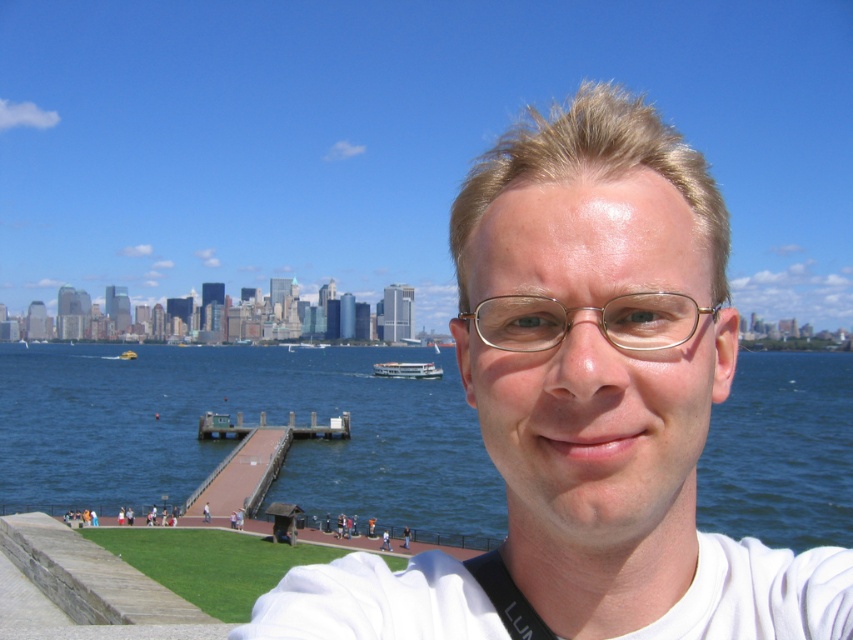
Does blue water at center lie in front of white glossy boat at center?

Yes, it is.

Is blue water at center to the left of white glossy boat at center from the viewer's perspective?

In fact, blue water at center is to the right of white glossy boat at center.

Between point (337, 444) and point (408, 376), which one is positioned in front?

Positioned in front is point (337, 444).

Identify the location of blue water at center. (247, 422).

Does white matte shirt at center lie in front of gold metallic glasses at center?

Yes, white matte shirt at center is closer to the viewer.

Can you confirm if white matte shirt at center is positioned above gold metallic glasses at center?

Indeed, white matte shirt at center is positioned over gold metallic glasses at center.

At what (x,y) coordinates should I click in order to perform the action: click on white matte shirt at center. Please return your answer as a coordinate pair (x, y). Looking at the image, I should click on (614, 381).

Image resolution: width=853 pixels, height=640 pixels. I want to click on white matte shirt at center, so click(614, 381).

Which is behind, point (405, 472) or point (515, 321)?

Positioned behind is point (405, 472).

Can you confirm if blue water at center is shorter than gold metallic glasses at center?

In fact, blue water at center may be taller than gold metallic glasses at center.

Between point (274, 368) and point (556, 332), which one is positioned in front?

Point (556, 332) is in front.

Find the location of a particular element. Image resolution: width=853 pixels, height=640 pixels. blue water at center is located at coordinates (247, 422).